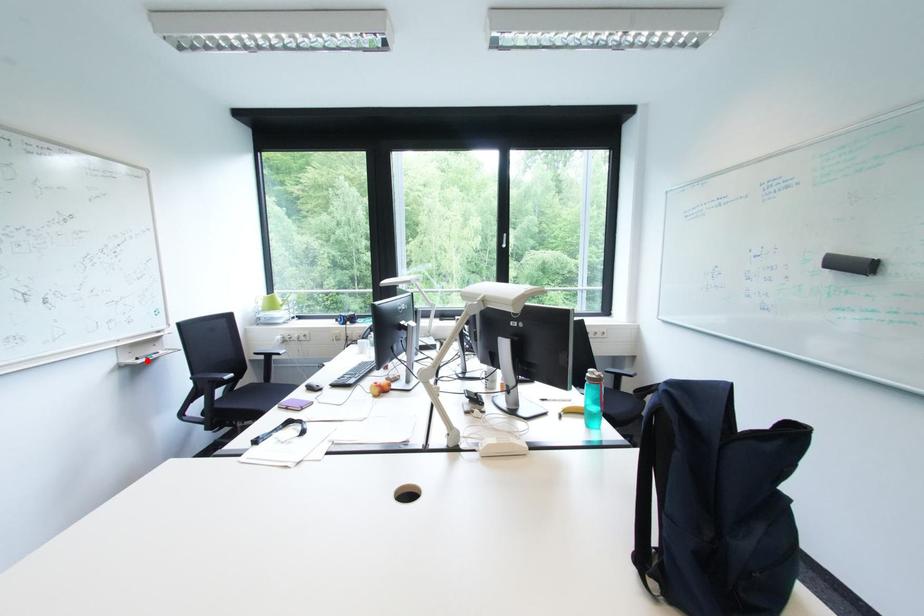
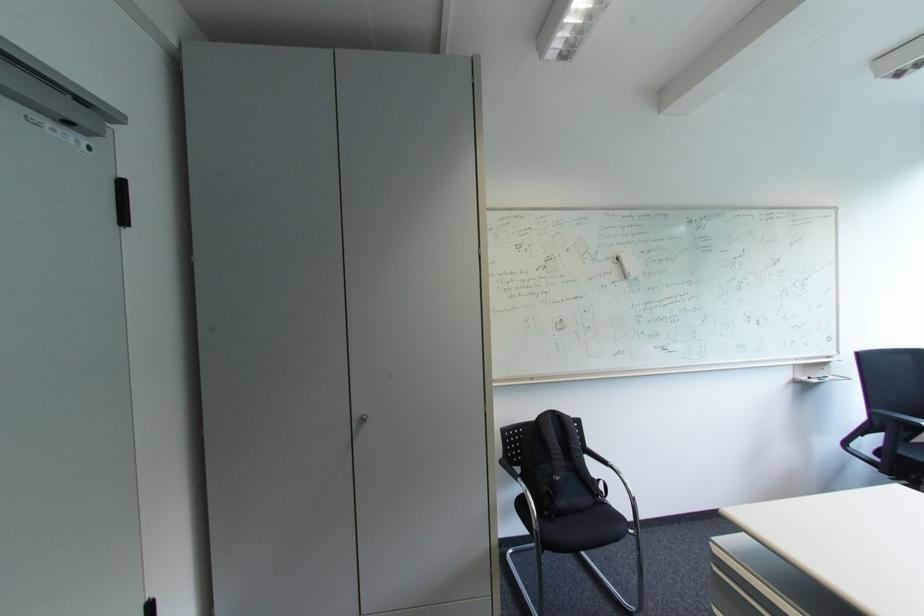
Where in the second image is the point corresponding to the highlighted location from the first image?

(819, 379)